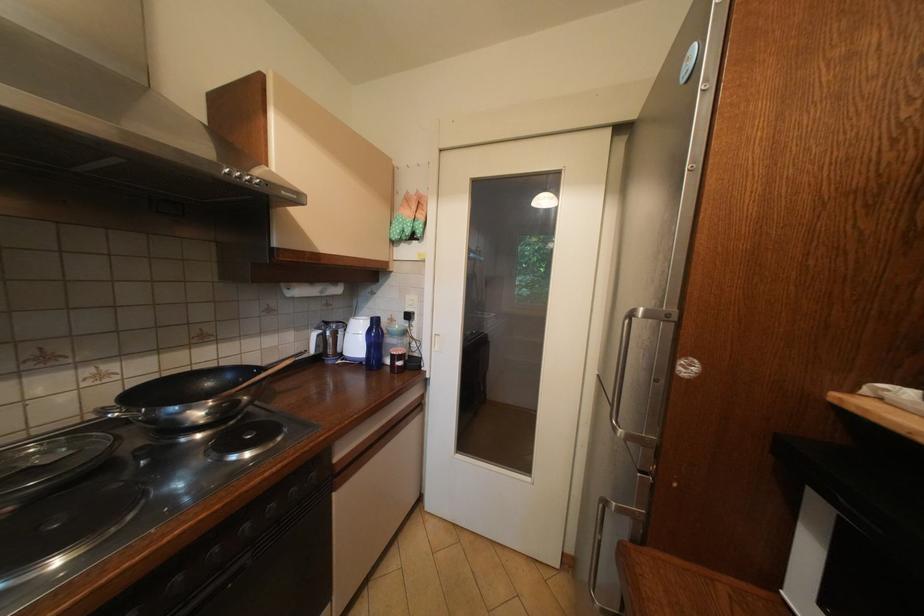
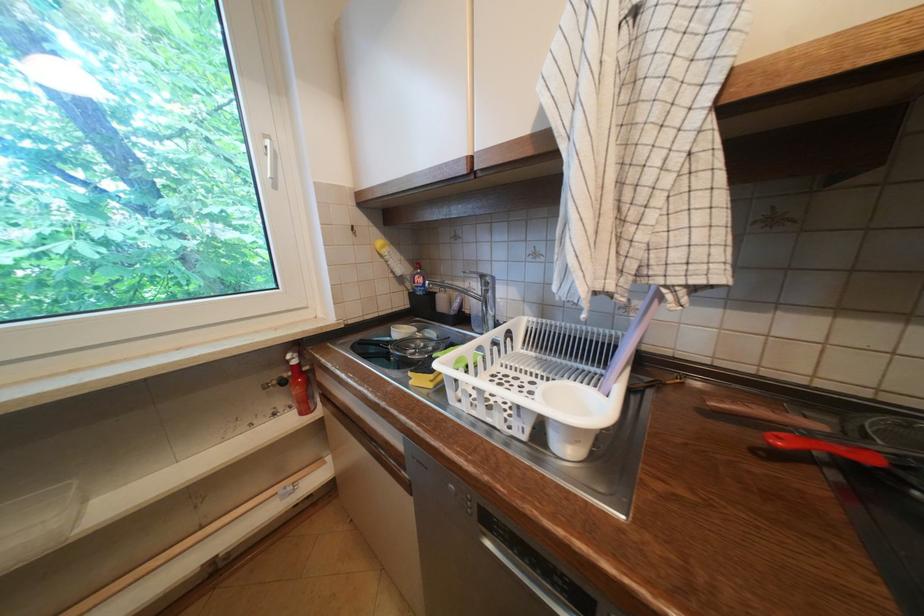
Question: The camera is either moving clockwise (left) or counter-clockwise (right) around the object. The first image is from the beginning of the video and the second image is from the end. Is the camera moving left or right when shooting the video?

Choices:
 (A) Left
 (B) Right

Answer: (B)